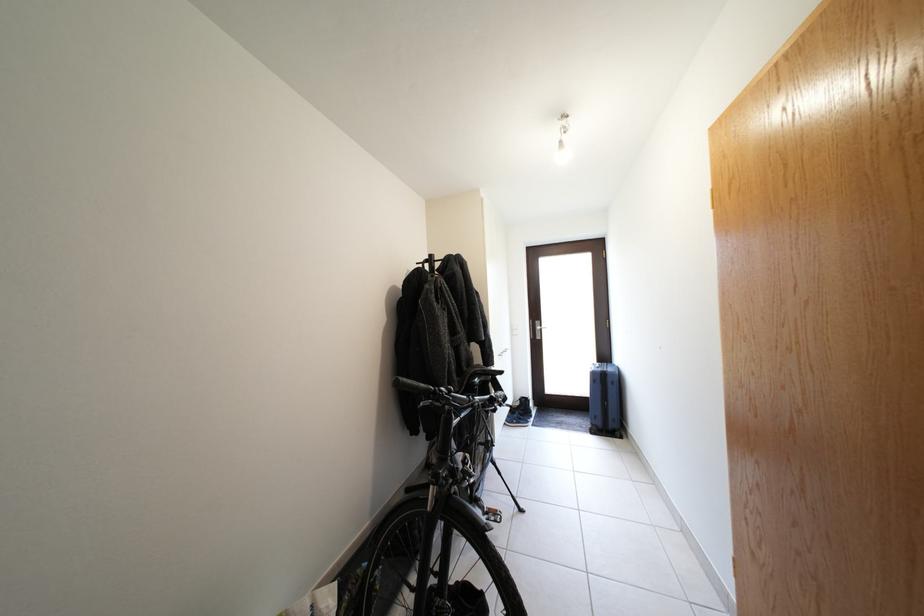
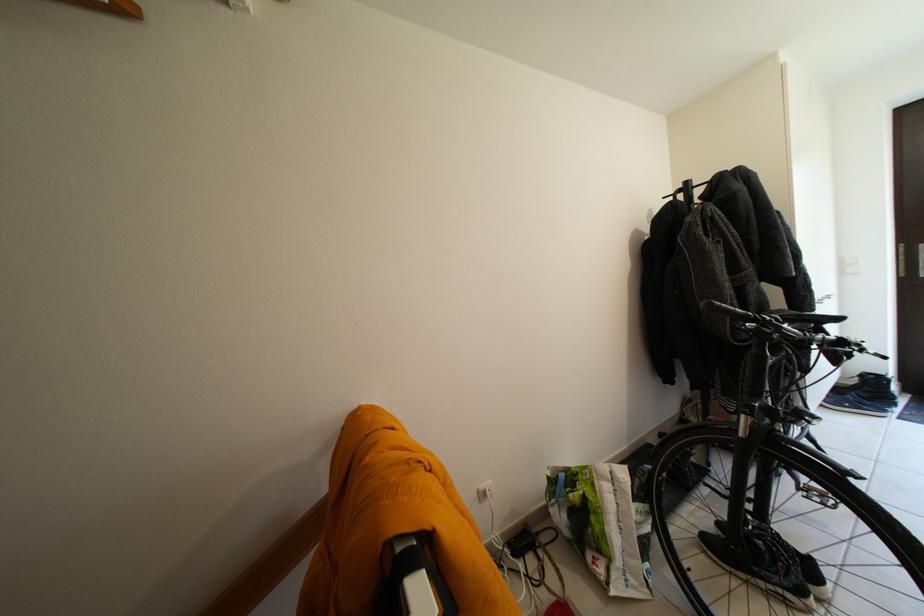
Question: The camera is either moving clockwise (left) or counter-clockwise (right) around the object. The first image is from the beginning of the video and the second image is from the end. Is the camera moving left or right when shooting the video?

Choices:
 (A) Left
 (B) Right

Answer: (B)